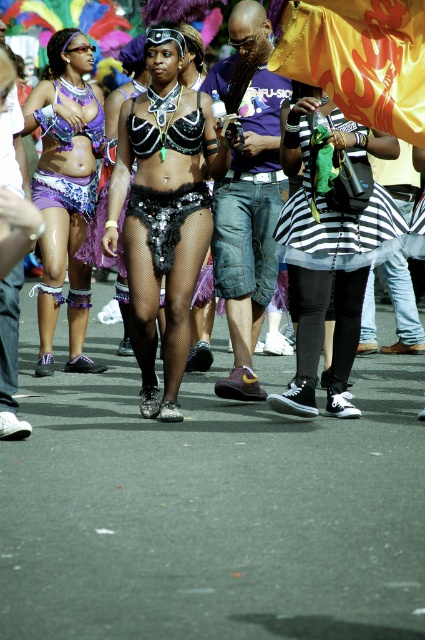
Question: Which of the following is the farthest from the observer?

Choices:
 (A) (96, 42)
 (B) (317, 176)
 (C) (342, 220)

Answer: (A)

Question: Does matte purple fabric skirt at center have a greater width compared to shiny sequined costume at center?

Choices:
 (A) yes
 (B) no

Answer: (B)

Question: Is black sequined bikini top at center bigger than matte purple fabric skirt at center?

Choices:
 (A) yes
 (B) no

Answer: (B)

Question: Is striped fabric skirt at center wider than black striped skirt at center?

Choices:
 (A) yes
 (B) no

Answer: (A)

Question: Which object appears closest to the camera in this image?

Choices:
 (A) black striped skirt at center
 (B) black sequined bikini top at center

Answer: (A)

Question: Which object appears closest to the camera in this image?

Choices:
 (A) matte purple fabric skirt at center
 (B) shiny sequined costume at center
 (C) black sequined bikini top at center

Answer: (C)